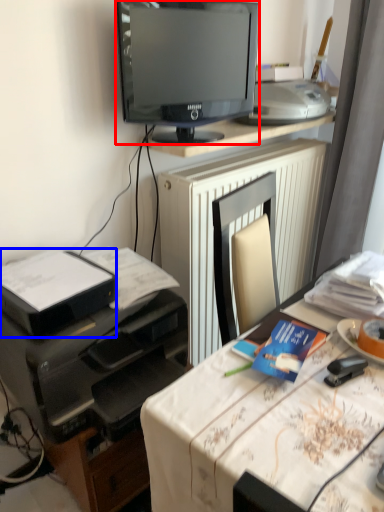
Question: Which of the following is the farthest to the observer, television (highlighted by a red box) or printer (highlighted by a blue box)?

Choices:
 (A) television
 (B) printer

Answer: (A)